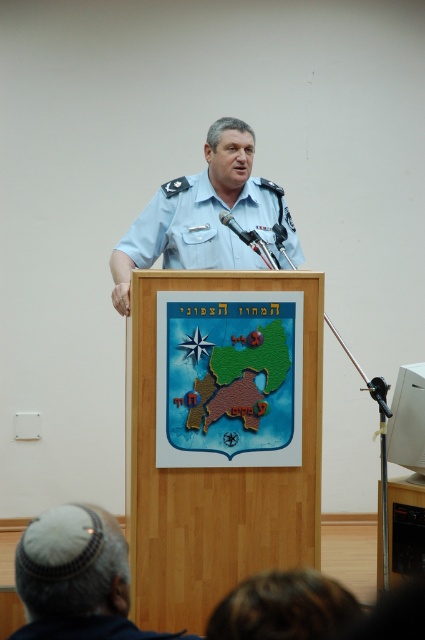
Question: Which object is closer to the camera taking this photo?

Choices:
 (A) blue uniform at center
 (B) white wool kippah at lower left
 (C) blue fabric uniform at center

Answer: (B)

Question: In this image, where is white wool kippah at lower left located relative to blue uniform at center?

Choices:
 (A) above
 (B) below

Answer: (B)

Question: Which object is the farthest from the white wool kippah at lower left?

Choices:
 (A) blue fabric uniform at center
 (B) blue uniform at center

Answer: (B)

Question: Is white wool kippah at lower left thinner than blue uniform at center?

Choices:
 (A) no
 (B) yes

Answer: (B)

Question: Based on their relative distances, which object is nearer to the blue uniform at center?

Choices:
 (A) blue fabric uniform at center
 (B) white wool kippah at lower left

Answer: (A)

Question: Is white wool kippah at lower left further to camera compared to blue fabric uniform at center?

Choices:
 (A) yes
 (B) no

Answer: (B)